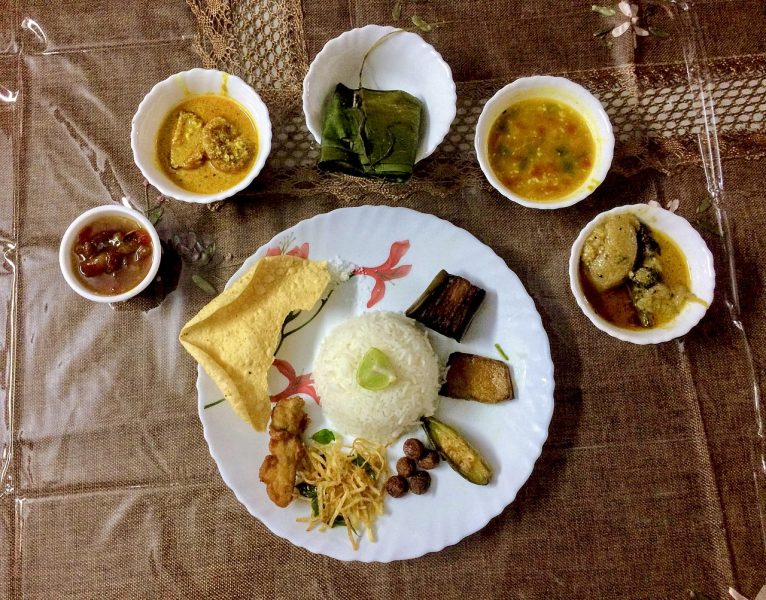
Where is `large bowl`? The width and height of the screenshot is (766, 600). large bowl is located at coordinates (411, 63).